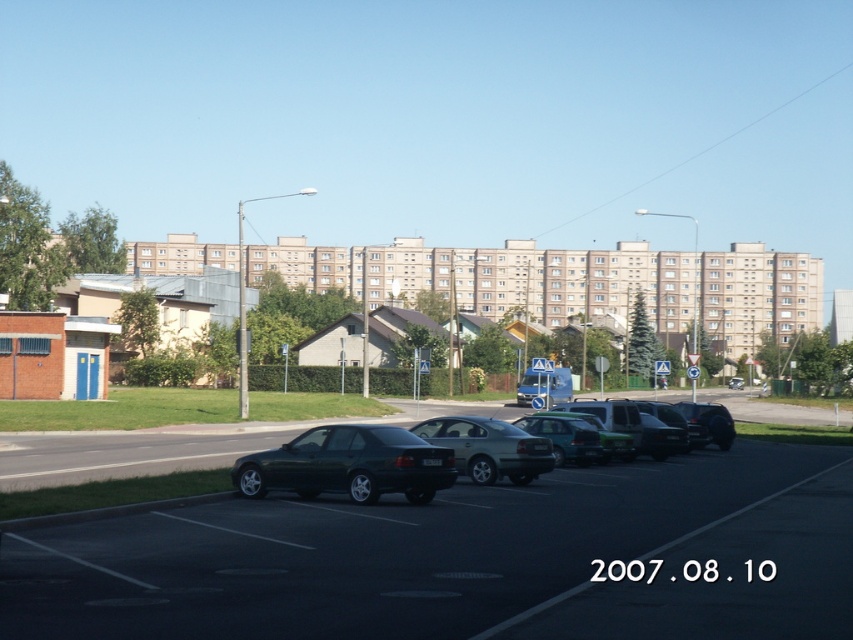
Question: Which point appears closest to the camera in this image?

Choices:
 (A) (682, 438)
 (B) (479, 476)
 (C) (558, 428)
 (D) (573, 589)

Answer: (D)

Question: Among these points, which one is nearest to the camera?

Choices:
 (A) (660, 406)
 (B) (723, 435)
 (C) (254, 621)

Answer: (C)

Question: Considering the relative positions of dark green metallic car at center and satin black car at right in the image provided, where is dark green metallic car at center located with respect to satin black car at right?

Choices:
 (A) right
 (B) left

Answer: (B)

Question: Does dark green metallic car at center appear on the left side of dark gray matte car at center?

Choices:
 (A) yes
 (B) no

Answer: (A)

Question: Is the position of shiny black car at center less distant than that of dark gray matte car at center?

Choices:
 (A) yes
 (B) no

Answer: (A)

Question: Which point appears closest to the camera in this image?

Choices:
 (A) (300, 464)
 (B) (729, 435)
 (C) (685, 422)

Answer: (A)